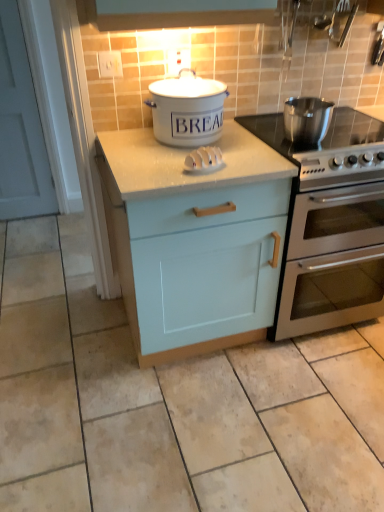
You are a GUI agent. You are given a task and a screenshot of the screen. Output one action in this format:
    pyautogui.click(x=<x>, y=<y>)
    Task: Click on the free space in front of light blue wood cabinet at center
    The height and width of the screenshot is (512, 384).
    Given the screenshot: What is the action you would take?
    pyautogui.click(x=187, y=426)